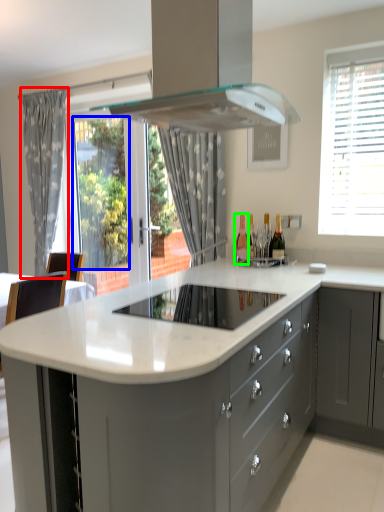
Question: Which object is the closest to the curtain (highlighted by a red box)? Choose among these: window screen (highlighted by a blue box) or bottle (highlighted by a green box).

Choices:
 (A) window screen
 (B) bottle

Answer: (A)